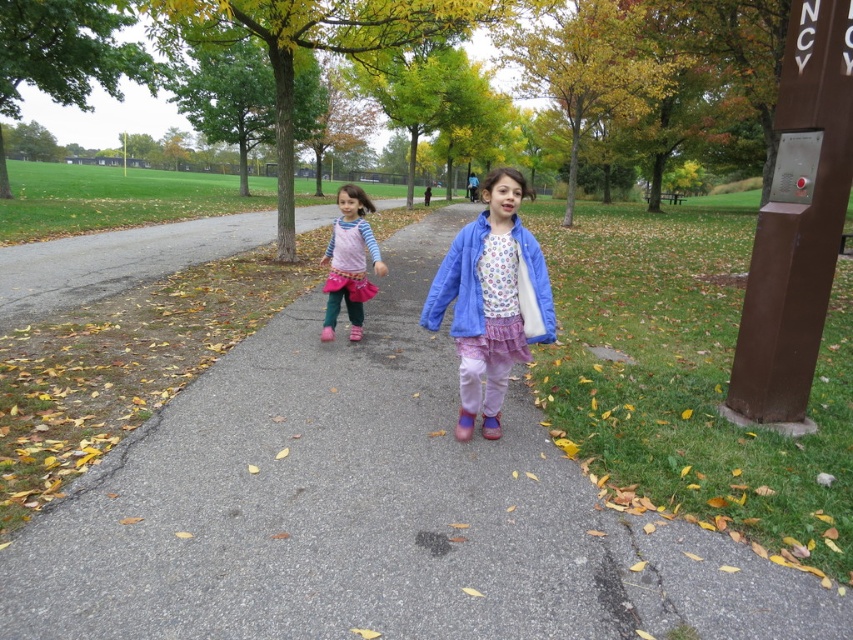
Question: Can you confirm if matte blue jacket at center is thinner than matte pink skirt at center?

Choices:
 (A) no
 (B) yes

Answer: (B)

Question: Is matte blue jacket at center below matte pink skirt at center?

Choices:
 (A) yes
 (B) no

Answer: (A)

Question: Considering the relative positions of gray asphalt pavement at center and matte blue jacket at center in the image provided, where is gray asphalt pavement at center located with respect to matte blue jacket at center?

Choices:
 (A) below
 (B) above

Answer: (A)

Question: Estimate the real-world distances between objects in this image. Which object is closer to the matte pink skirt at center?

Choices:
 (A) gray asphalt pavement at center
 (B) matte blue jacket at center

Answer: (A)

Question: Which object is the closest to the gray asphalt pavement at center?

Choices:
 (A) matte pink skirt at center
 (B) matte blue jacket at center

Answer: (A)

Question: Estimate the real-world distances between objects in this image. Which object is farther from the gray asphalt pavement at center?

Choices:
 (A) matte pink skirt at center
 (B) matte blue jacket at center

Answer: (B)